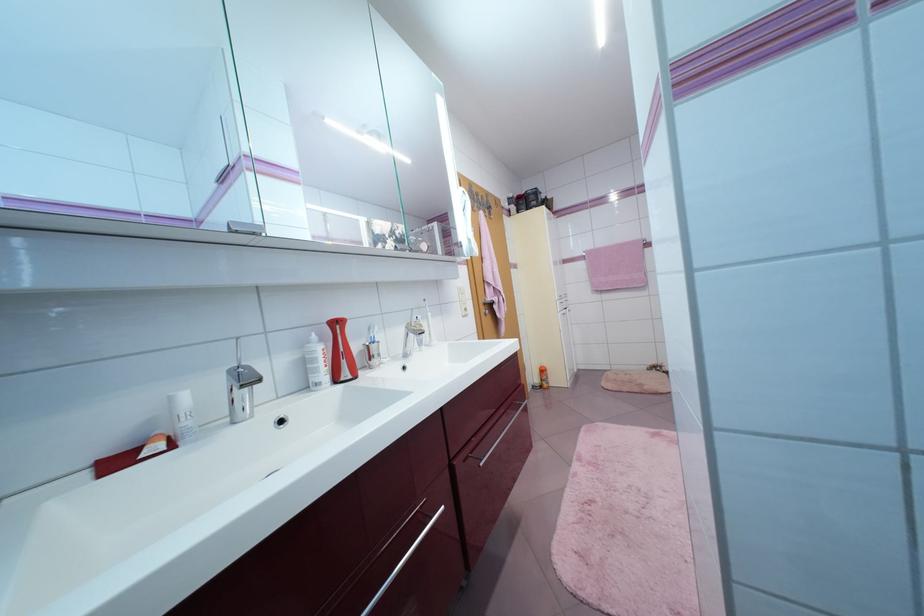
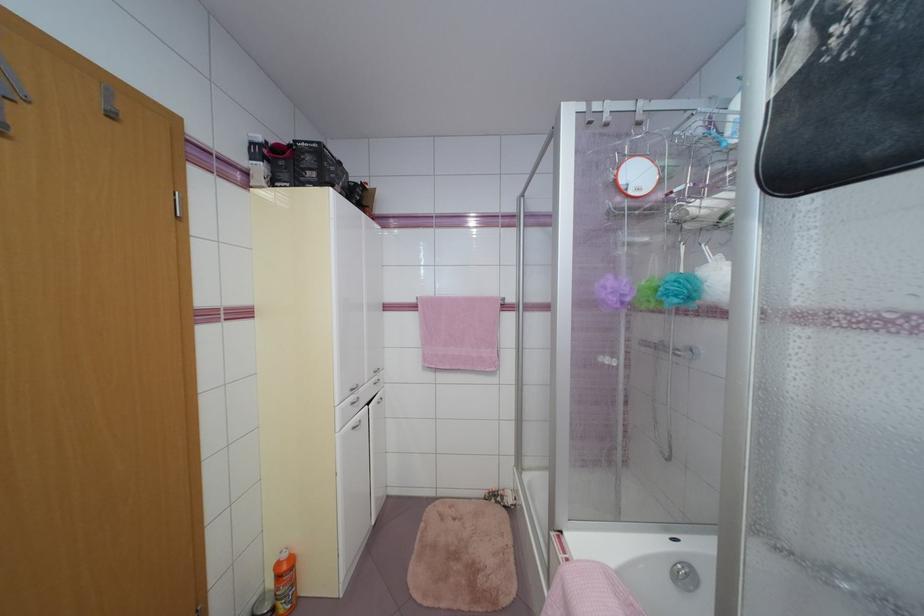
Locate, in the second image, the point that corresponds to [599,274] in the first image.

(433, 336)